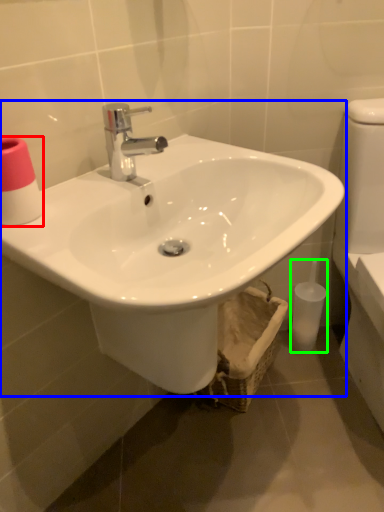
Question: Based on their relative distances, which object is nearer to toilet paper (highlighted by a red box)? Choose from sink (highlighted by a blue box) and toiletry (highlighted by a green box).

Choices:
 (A) sink
 (B) toiletry

Answer: (A)